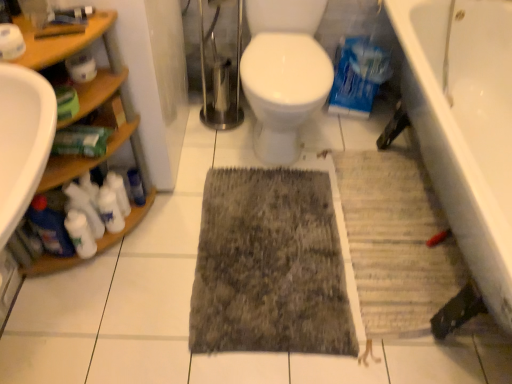
Locate an element on the screen. This screenshot has height=384, width=512. free point to the left of gray textured bath mat at lower right is located at coordinates (260, 231).